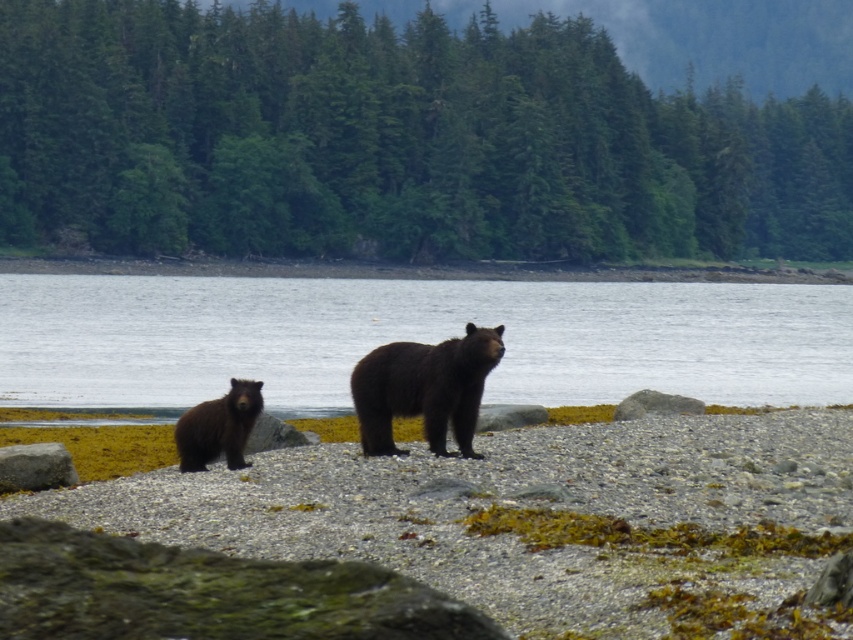
Question: Is shiny dark brown bear at center behind gray rock at lower left?

Choices:
 (A) no
 (B) yes

Answer: (B)

Question: Estimate the real-world distances between objects in this image. Which object is farther from the green leafy trees at center?

Choices:
 (A) gray rock at lower left
 (B) clear water at center
 (C) shiny dark brown bear at center

Answer: (A)

Question: Which of these objects is positioned farthest from the green leafy trees at center?

Choices:
 (A) gray rock at lower left
 (B) shiny dark brown bear at center
 (C) clear water at center

Answer: (A)

Question: Among these objects, which one is farthest from the camera?

Choices:
 (A) clear water at center
 (B) brown furry bear at lower left
 (C) green leafy trees at center

Answer: (C)

Question: Can you confirm if green leafy trees at center is positioned to the right of smooth gravel beach at center?

Choices:
 (A) yes
 (B) no

Answer: (B)

Question: Does green leafy trees at center have a larger size compared to gray rock at lower left?

Choices:
 (A) no
 (B) yes

Answer: (B)